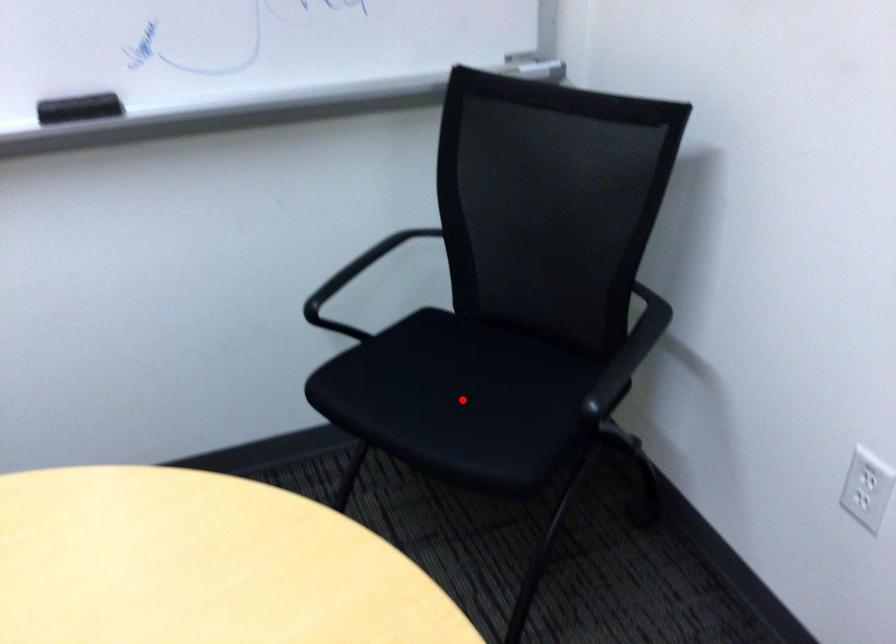
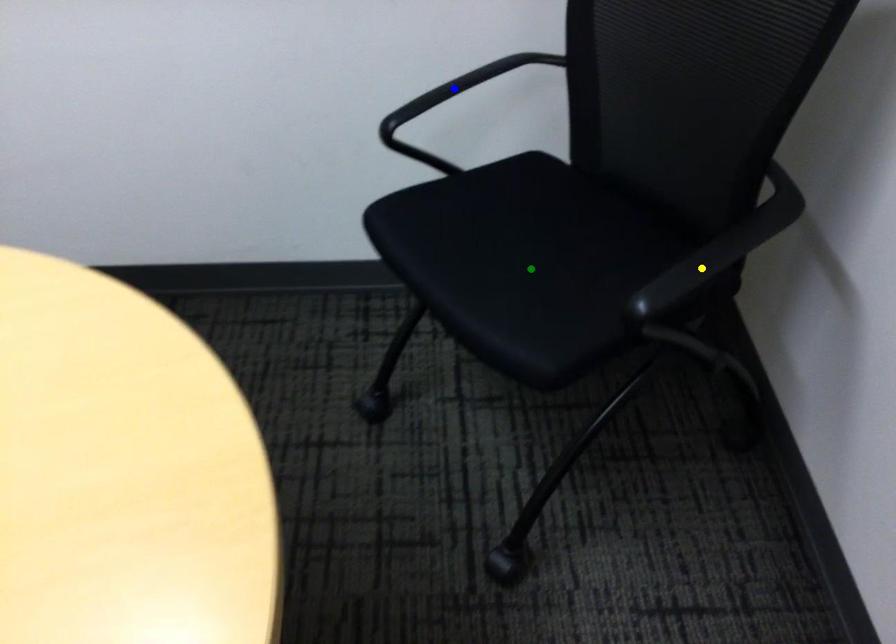
Question: I am providing you with two images of the same scene from different viewpoints. A red point is marked on the first image. You are given multiple points on the second image. Which spot in image 2 lines up with the point in image 1?

Choices:
 (A) green point
 (B) blue point
 (C) yellow point

Answer: (A)